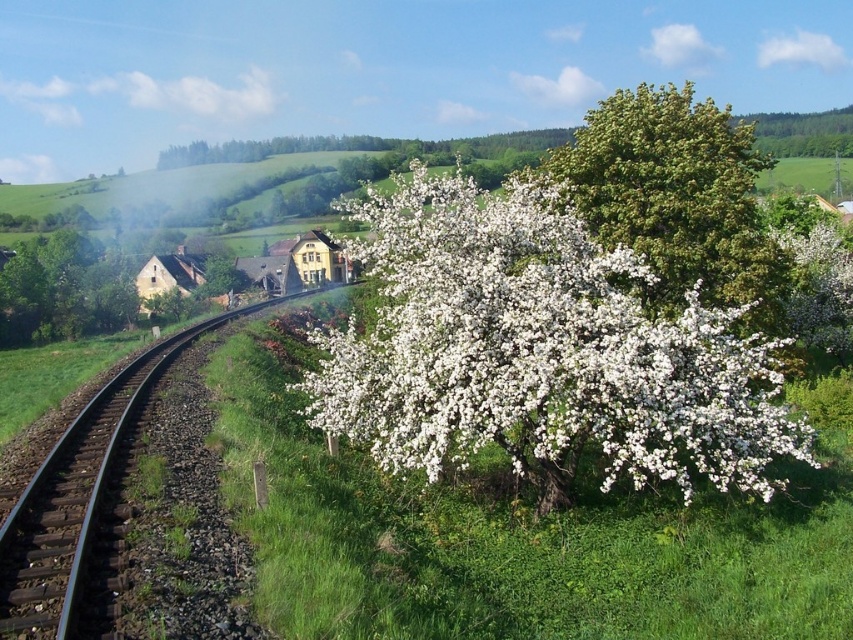
Based on the scene description, where is the green leafy tree at upper center located in terms of coordinates?

The green leafy tree at upper center is located at coordinates point (677, 198).

You are a photographer standing at the edge of the railway track. You want to take a photo that includes both the white fluffy blossoms at center and the black metal train track at center. Which object will appear larger in the photo?

The white fluffy blossoms at center will appear larger in the photo because they are taller than the black metal train track at center.

You are a photographer planning to capture a wide shot of the landscape. You want to ensure that both the white fluffy blossoms at center and the green leafy tree at upper center are fully visible in the frame. Based on their sizes, which object might require you to adjust your camera angle to avoid cropping?

The white fluffy blossoms at center might be wider than the green leafy tree at upper center, so you may need to adjust your camera angle to ensure the blossoms are fully visible without cropping.